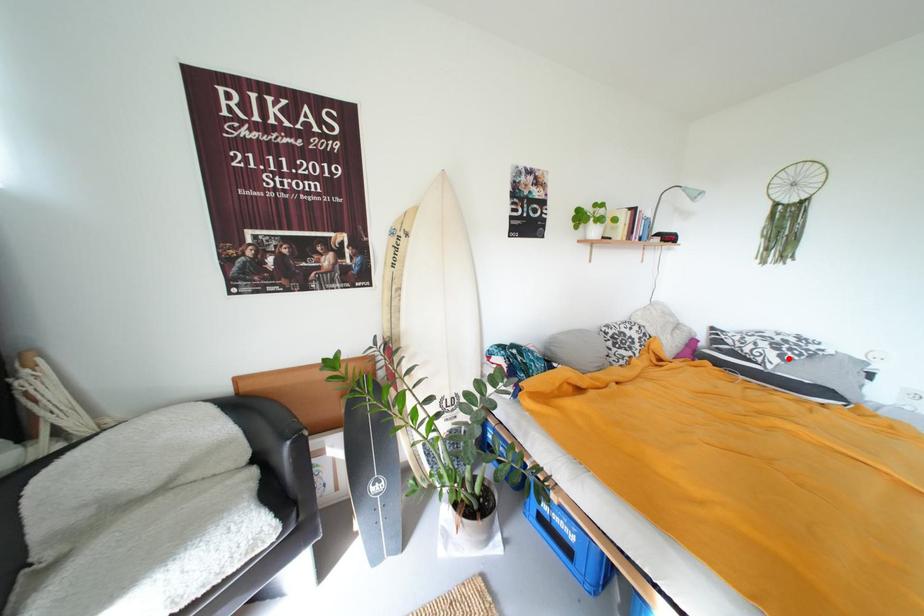
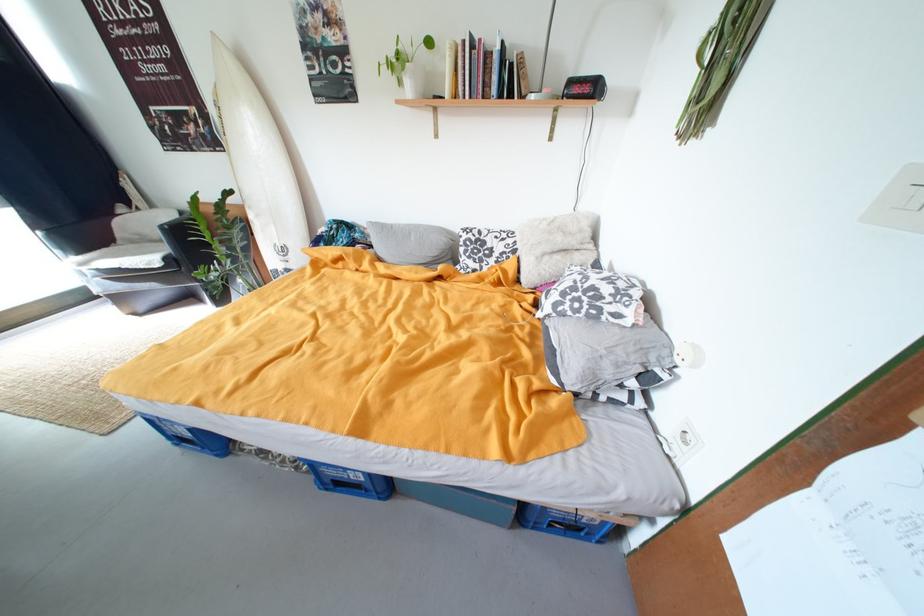
Question: I am providing you with two images of the same scene from different viewpoints. Image1 has a red point marked. In image2, the corresponding 3D location appears at what relative position? Reply with the corresponding letter.

Choices:
 (A) Closer
 (B) Farther

Answer: (A)